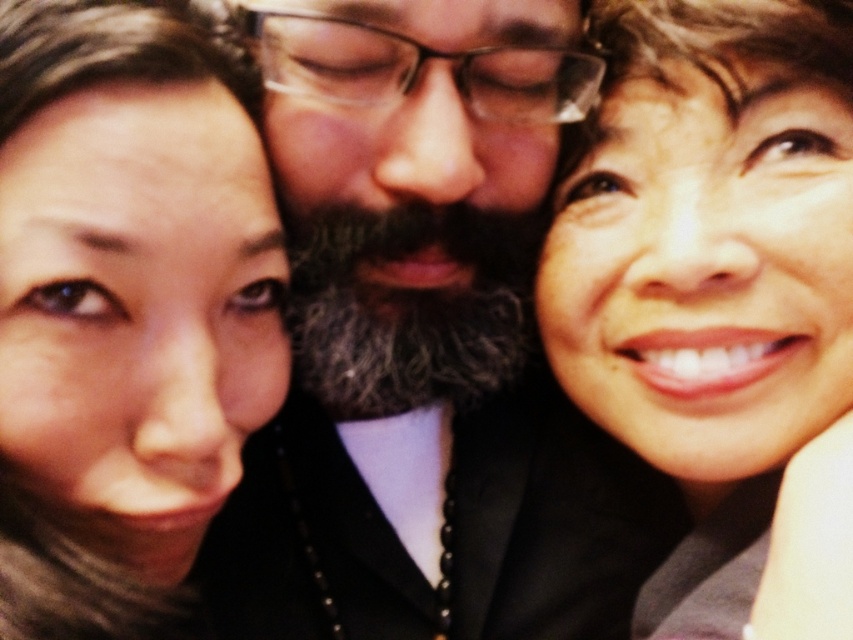
You are a photographer reviewing a group selfie. You notice the gray beard at center and the smooth skin face at upper left. Which of these two elements is located higher in the image?

The smooth skin face at upper left is higher in the image because the gray beard at center is positioned under it.

You are a photographer trying to adjust the focus of your camera. You need to ensure that both the gray beard at center and the smooth skin face at upper right are in focus. Given their positions, which one should you focus on first to maximize the chances of both being sharp?

You should focus on the gray beard at center first because it is much taller than the smooth skin face at upper right, so focusing on the closer subject increases the likelihood of both being in focus.